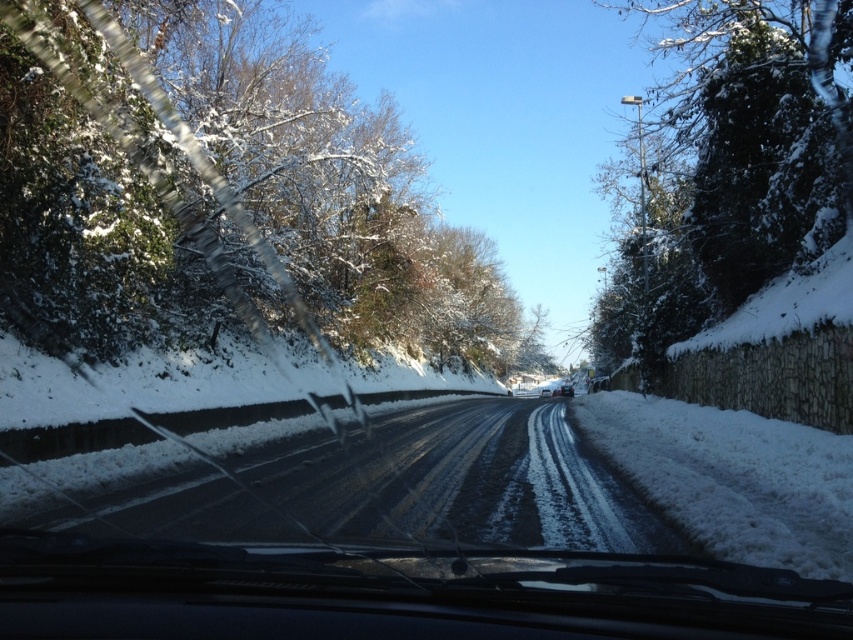
Question: Is the position of snow-covered evergreen at right less distant than that of metallic silver car at center?

Choices:
 (A) no
 (B) yes

Answer: (B)

Question: Among these points, which one is nearest to the camera?

Choices:
 (A) (566, 387)
 (B) (230, 61)

Answer: (B)

Question: Does snow-covered evergreen at right have a larger size compared to metallic silver car at center?

Choices:
 (A) no
 (B) yes

Answer: (B)

Question: Which object is closer to the camera taking this photo?

Choices:
 (A) snow-covered evergreen at right
 (B) metallic silver car at center

Answer: (A)

Question: From the image, what is the correct spatial relationship of snow-covered trees at left in relation to metallic silver car at center?

Choices:
 (A) above
 (B) below

Answer: (A)

Question: Which of the following is the closest to the observer?

Choices:
 (A) (798, 193)
 (B) (425, 204)
 (C) (564, 390)

Answer: (A)